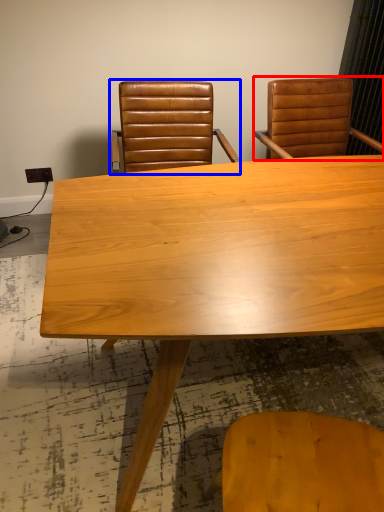
Question: Which object appears closest to the camera in this image, chair (highlighted by a red box) or chair (highlighted by a blue box)?

Choices:
 (A) chair
 (B) chair

Answer: (B)